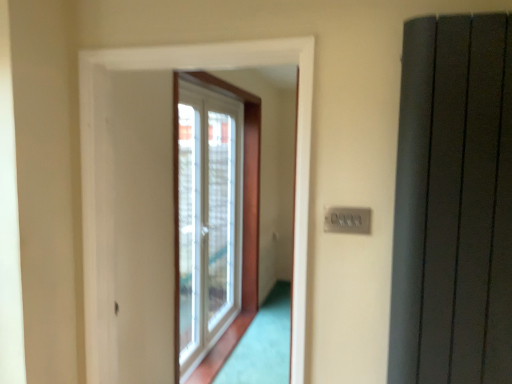
The width and height of the screenshot is (512, 384). Describe the element at coordinates (453, 204) in the screenshot. I see `matte gray radiator at right` at that location.

In order to face matte gray radiator at right, should I rotate leftwards or rightwards?

To face it directly, rotate right by 24.342 degrees.

What is the approximate width of white plastic window at center?

white plastic window at center is 7.94 inches in width.

What do you see at coordinates (213, 212) in the screenshot?
I see `white plastic window at center` at bounding box center [213, 212].

What do you see at coordinates (347, 220) in the screenshot? I see `gray plastic switch at upper right` at bounding box center [347, 220].

You are a GUI agent. You are given a task and a screenshot of the screen. Output one action in this format:
    pyautogui.click(x=<x>, y=<y>)
    Task: Click on the matte gray radiator at right
    
    Given the screenshot: What is the action you would take?
    pyautogui.click(x=453, y=204)

From the image's perspective, which one is positioned lower, white plastic window at center or matte gray radiator at right?

white plastic window at center is shown below in the image.

Would you consider white plastic window at center to be distant from matte gray radiator at right?

Absolutely, white plastic window at center is distant from matte gray radiator at right.

Locate an element on the screen. window on the left of matte gray radiator at right is located at coordinates (213, 212).

Does gray plastic switch at upper right have a greater width compared to white plastic window at center?

Incorrect, the width of gray plastic switch at upper right does not surpass that of white plastic window at center.

From a real-world perspective, which is physically below, gray plastic switch at upper right or white plastic window at center?

white plastic window at center, from a real-world perspective.

Is gray plastic switch at upper right bigger or smaller than white plastic window at center?

gray plastic switch at upper right is smaller than white plastic window at center.

Who is taller, matte gray radiator at right or white plastic window at center?

white plastic window at center is taller.

Is matte gray radiator at right situated inside white plastic window at center or outside?

matte gray radiator at right is not enclosed by white plastic window at center.

Can you confirm if matte gray radiator at right is thinner than white plastic window at center?

Yes, matte gray radiator at right is thinner than white plastic window at center.

Considering the positions of objects gray plastic switch at upper right and matte gray radiator at right in the image provided, who is in front, gray plastic switch at upper right or matte gray radiator at right?

matte gray radiator at right.

Can you see gray plastic switch at upper right touching matte gray radiator at right?

No, gray plastic switch at upper right is not with matte gray radiator at right.

From the image's perspective, which one is positioned lower, gray plastic switch at upper right or matte gray radiator at right?

From the image's view, gray plastic switch at upper right is below.

Which is closer, (251, 287) or (370, 210)?

The point (370, 210) is closer to the camera.

Does white plastic window at center contain gray plastic switch at upper right?

No, gray plastic switch at upper right is not a part of white plastic window at center.

Is the position of white plastic window at center less distant than that of gray plastic switch at upper right?

No.

Which is closer to the camera, [411,206] or [338,213]?

The point [411,206] is more forward.

Identify the location of electric outlet on the left of the matte gray radiator at right. The width and height of the screenshot is (512, 384). (347, 220).

Is matte gray radiator at right in contact with gray plastic switch at upper right?

They are not placed beside each other.

The height and width of the screenshot is (384, 512). There is a white plastic window at center. Find the location of `elevator above it (from a real-world perspective)`. elevator above it (from a real-world perspective) is located at coordinates (453, 204).

Identify the location of window below the gray plastic switch at upper right (from a real-world perspective). (213, 212).

Considering their positions, is white plastic window at center positioned closer to matte gray radiator at right than gray plastic switch at upper right?

The object closer to matte gray radiator at right is gray plastic switch at upper right.

Based on their spatial positions, is matte gray radiator at right or white plastic window at center closer to gray plastic switch at upper right?

Based on the image, matte gray radiator at right appears to be nearer to gray plastic switch at upper right.

Which object lies further to the anchor point matte gray radiator at right, gray plastic switch at upper right or white plastic window at center?

white plastic window at center lies further to matte gray radiator at right than the other object.

Based on their spatial positions, is white plastic window at center or matte gray radiator at right further from gray plastic switch at upper right?

white plastic window at center is positioned further to the anchor gray plastic switch at upper right.

From the image, which object appears to be farther from white plastic window at center, matte gray radiator at right or gray plastic switch at upper right?

gray plastic switch at upper right is positioned further to the anchor white plastic window at center.

Looking at this image, based on their spatial positions, is gray plastic switch at upper right or matte gray radiator at right further from white plastic window at center?

gray plastic switch at upper right is positioned further to the anchor white plastic window at center.

Where is `electric outlet positioned between matte gray radiator at right and white plastic window at center from near to far`? electric outlet positioned between matte gray radiator at right and white plastic window at center from near to far is located at coordinates (347, 220).